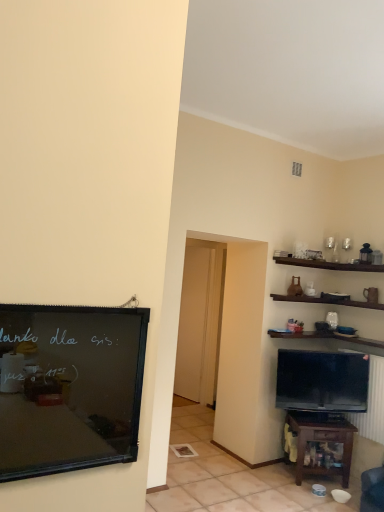
Locate an element on the screen. Image resolution: width=384 pixels, height=512 pixels. vacant space that is to the left of brown wooden table at lower right is located at coordinates (272, 476).